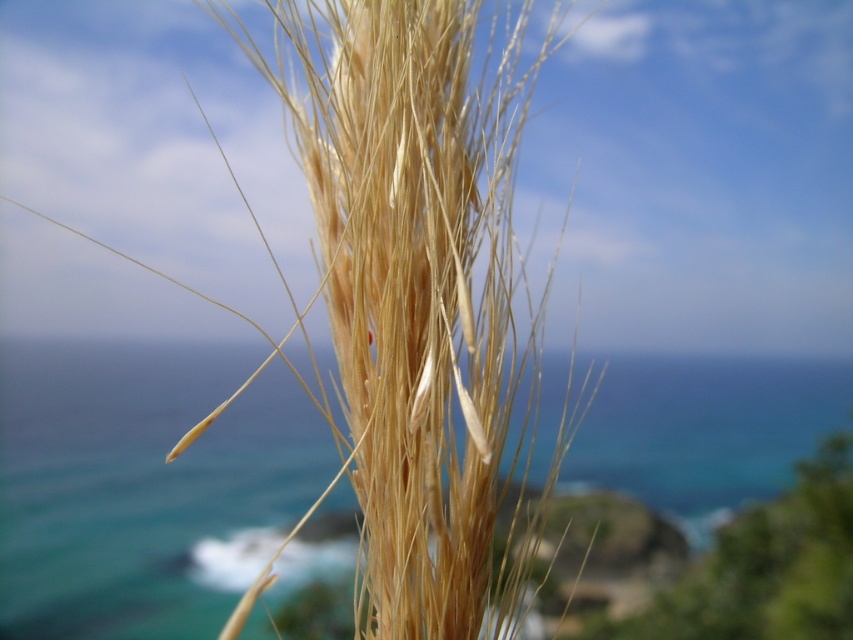
You are a photographer aiming to capture the golden straw reed at center and the blue water at center in a single frame. Based on their positions, which object is closer to the camera?

The golden straw reed at center is located above the blue water at center, so it is closer to the camera.

You are a photographer trying to capture the golden straw reed at center and the blue water at center in the same frame. Based on their heights, which one will appear larger in the photo?

The golden straw reed at center is much taller than the blue water at center, so it will appear larger in the photo.